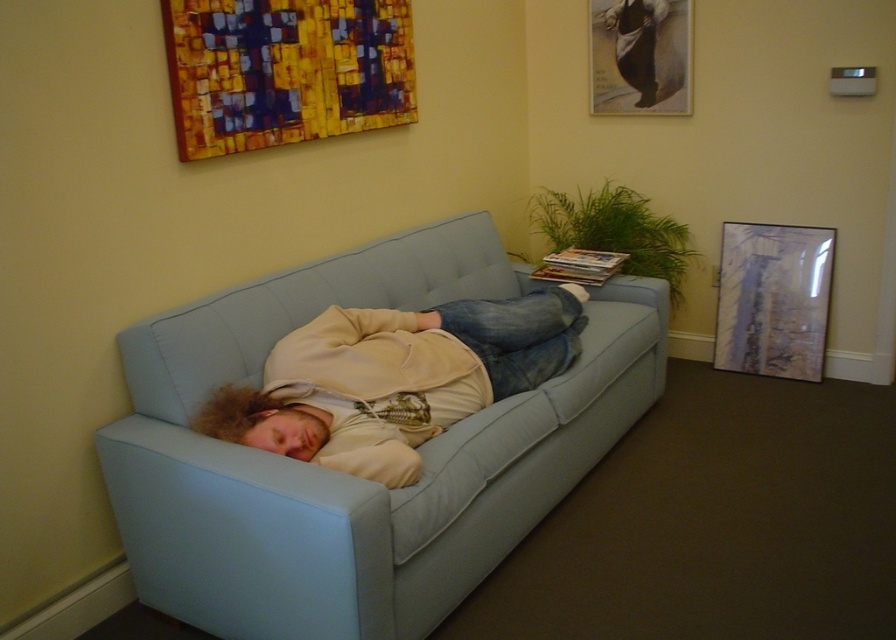
Question: Does light blue fabric couch at center come behind matte glass picture frame at upper right?

Choices:
 (A) yes
 (B) no

Answer: (B)

Question: Does beige fleece jacket at center have a lesser width compared to matte paper picture frame at upper right?

Choices:
 (A) yes
 (B) no

Answer: (B)

Question: Based on their relative distances, which object is nearer to the matte glass picture frame at upper right?

Choices:
 (A) matte paper picture frame at upper right
 (B) light blue fabric couch at center
 (C) beige fleece jacket at center

Answer: (A)

Question: Which object is farther from the camera taking this photo?

Choices:
 (A) light blue fabric couch at center
 (B) matte glass picture frame at upper right
 (C) beige fleece jacket at center
 (D) matte paper picture frame at upper right

Answer: (D)

Question: Among these objects, which one is farthest from the camera?

Choices:
 (A) matte glass picture frame at upper right
 (B) beige fleece jacket at center
 (C) light blue fabric couch at center

Answer: (A)

Question: Can you confirm if light blue fabric couch at center is positioned below matte paper picture frame at upper right?

Choices:
 (A) yes
 (B) no

Answer: (A)